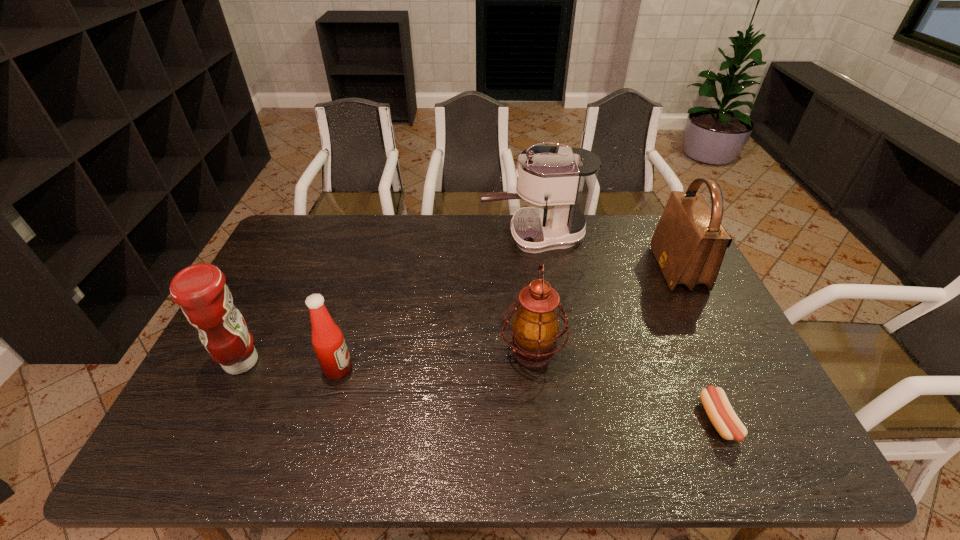
You are a GUI agent. You are given a task and a screenshot of the screen. Output one action in this format:
    pyautogui.click(x=<x>, y=<y>)
    Task: Click on the vacant area that lies between the left condiment and the shortest object
    The height and width of the screenshot is (540, 960).
    Given the screenshot: What is the action you would take?
    pyautogui.click(x=480, y=392)

Locate an element on the screen. The width and height of the screenshot is (960, 540). free spot between the oil lamp and the fifth tallest object is located at coordinates (435, 360).

The height and width of the screenshot is (540, 960). I want to click on free space between the coffee maker and the shoulder bag, so click(606, 252).

Locate an element on the screen. The height and width of the screenshot is (540, 960). vacant region between the fifth object from right to left and the coffee maker is located at coordinates (436, 302).

This screenshot has height=540, width=960. I want to click on free space between the shoulder bag and the coffee maker, so click(x=606, y=252).

Where is `free space between the shorter condiment and the leftmost object`? The image size is (960, 540). free space between the shorter condiment and the leftmost object is located at coordinates (290, 366).

Locate an element on the screen. The height and width of the screenshot is (540, 960). free spot between the right condiment and the shortest object is located at coordinates (528, 395).

This screenshot has width=960, height=540. Identify the location of vacant space that is in between the nearest object and the oil lamp. (626, 387).

At what (x,y) coordinates should I click in order to perform the action: click on free space between the oil lamp and the shoulder bag. Please return your answer as a coordinate pair (x, y). Looking at the image, I should click on click(x=605, y=310).

In order to click on empty space that is in between the shoulder bag and the oil lamp in this screenshot , I will do `click(605, 310)`.